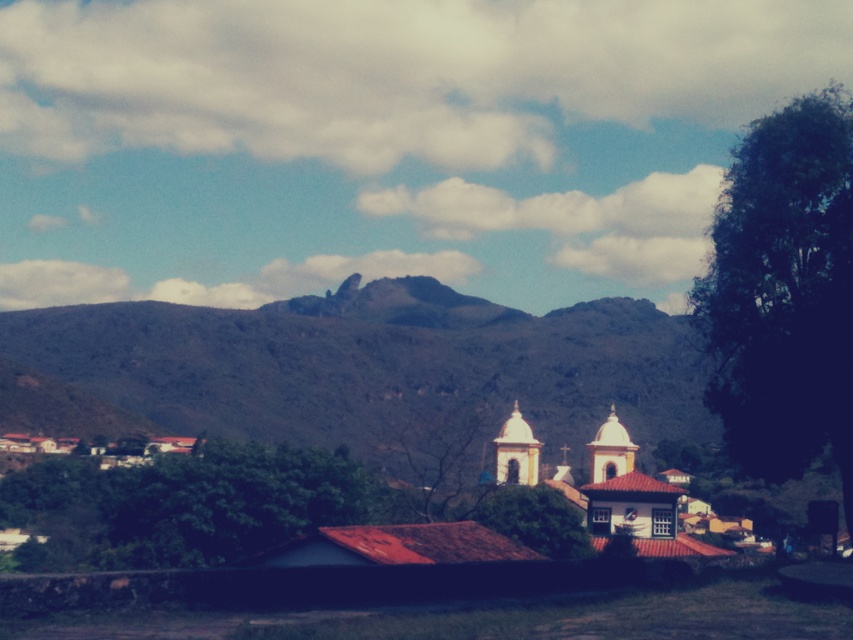
Question: Estimate the real-world distances between objects in this image. Which object is closer to the green grassy mountain at center?

Choices:
 (A) yellow matte church at center
 (B) green leafy tree at right

Answer: (A)

Question: In this image, where is green grassy mountain at center located relative to green leafy tree at right?

Choices:
 (A) left
 (B) right

Answer: (A)

Question: Among these objects, which one is nearest to the camera?

Choices:
 (A) green leafy tree at right
 (B) yellow matte church at center
 (C) green grassy mountain at center

Answer: (A)

Question: Among these objects, which one is nearest to the camera?

Choices:
 (A) yellow matte church at center
 (B) green grassy mountain at center

Answer: (A)

Question: Is green grassy mountain at center further to camera compared to yellow matte church at center?

Choices:
 (A) yes
 (B) no

Answer: (A)

Question: Does green grassy mountain at center have a larger size compared to green leafy tree at right?

Choices:
 (A) no
 (B) yes

Answer: (B)